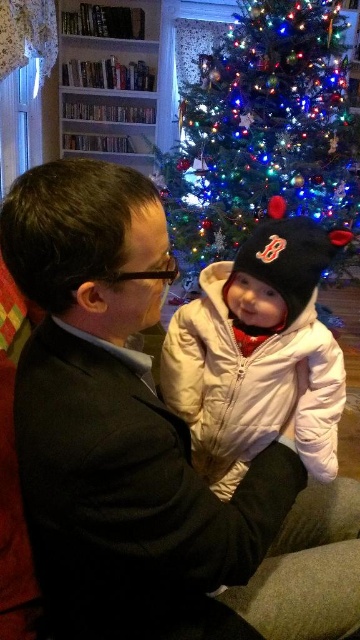
Based on the photo, does dark suit at center appear on the left side of iridescent plastic christmas tree at upper center?

Yes, dark suit at center is to the left of iridescent plastic christmas tree at upper center.

Consider the image. Does dark suit at center have a greater width compared to iridescent plastic christmas tree at upper center?

No.

Identify the location of dark suit at center. (123, 429).

Does iridescent plastic christmas tree at upper center lie behind white puffy coat at center?

Yes, it is.

Who is more forward, (227,104) or (217,422)?

Point (217,422) is in front.

Image resolution: width=360 pixels, height=640 pixels. Find the location of `iridescent plastic christmas tree at upper center`. iridescent plastic christmas tree at upper center is located at coordinates (263, 131).

Can you confirm if dark suit at center is taller than white puffy coat at center?

Indeed, dark suit at center has a greater height compared to white puffy coat at center.

Is dark suit at center positioned in front of white puffy coat at center?

Yes, it is in front of white puffy coat at center.

Which is behind, point (105, 388) or point (335, 342)?

Positioned behind is point (335, 342).

I want to click on dark suit at center, so click(123, 429).